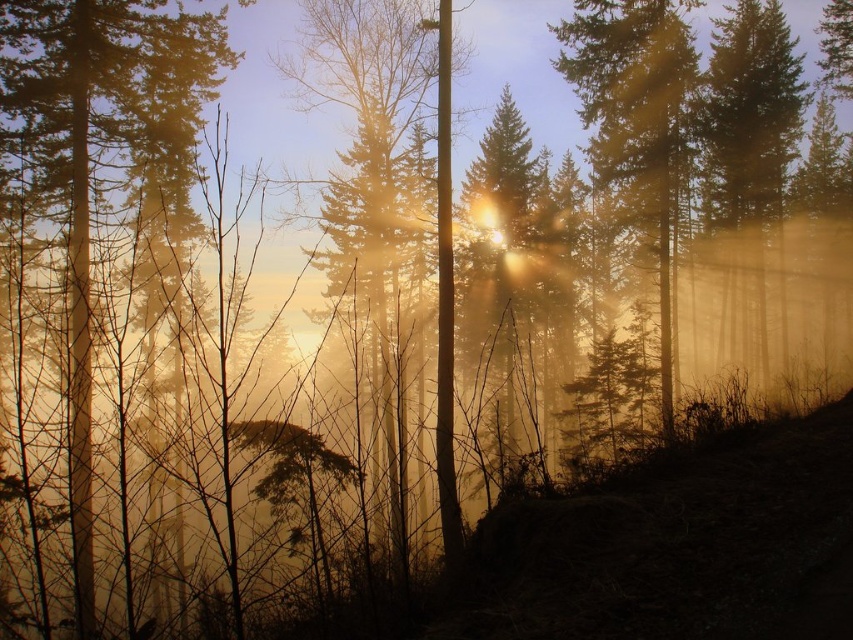
Question: Where is silvery metallic tree at center located in relation to glossy evergreen tree at center in the image?

Choices:
 (A) below
 (B) above

Answer: (B)

Question: Can you confirm if smooth brown tree trunk at left is positioned above smooth golden tree at right?

Choices:
 (A) no
 (B) yes

Answer: (B)

Question: Does glossy evergreen tree at center come in front of green matte tree at upper right?

Choices:
 (A) no
 (B) yes

Answer: (B)

Question: Which of the following is the closest to the observer?

Choices:
 (A) green matte tree at upper right
 (B) smooth brown tree trunk at left

Answer: (B)

Question: Which point is closer to the camera taking this photo?

Choices:
 (A) (624, 13)
 (B) (711, 99)
 (C) (86, 131)

Answer: (C)

Question: Which of these objects is positioned closest to the smooth brown tree trunk at left?

Choices:
 (A) silvery metallic tree at center
 (B) green matte tree at upper right
 (C) smooth golden tree at right
 (D) glossy evergreen tree at center

Answer: (D)